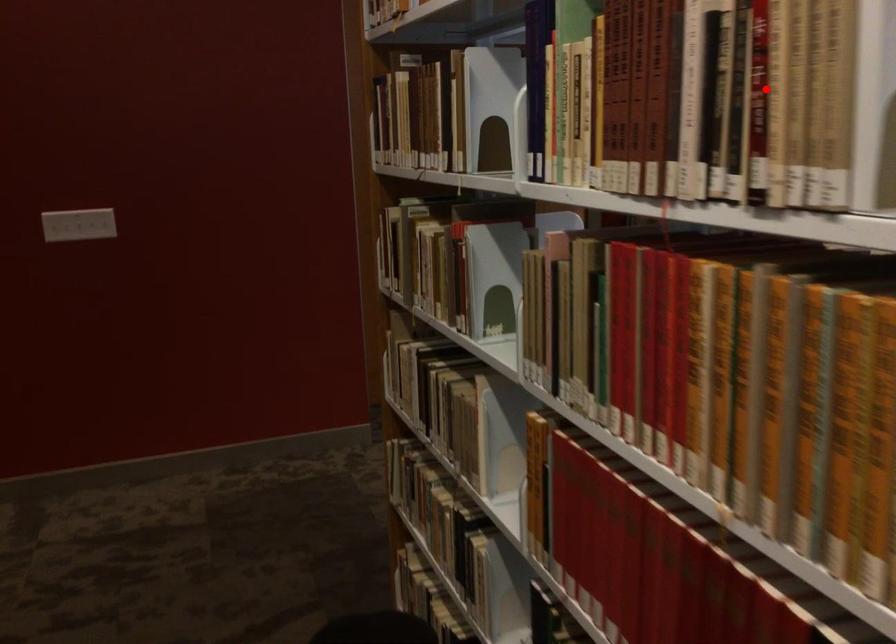
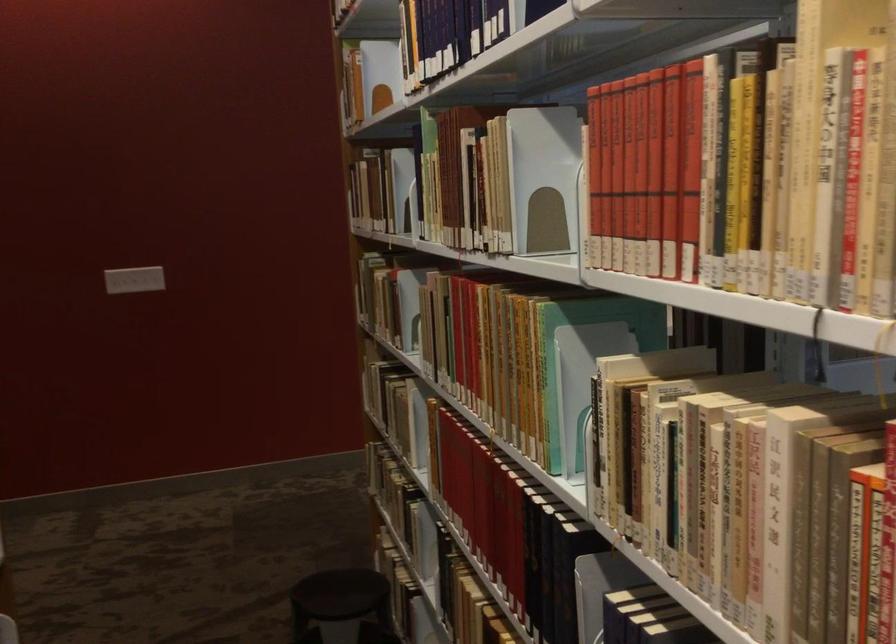
Where in the second image is the point corresponding to the highlighted location from the first image?

(487, 187)